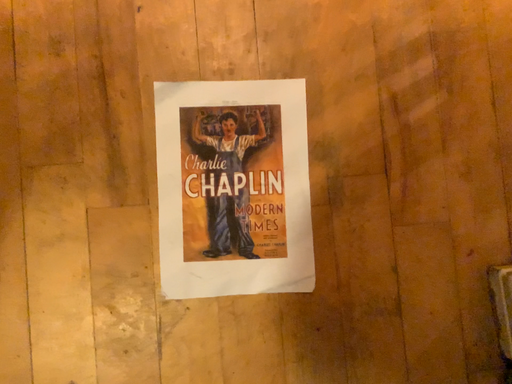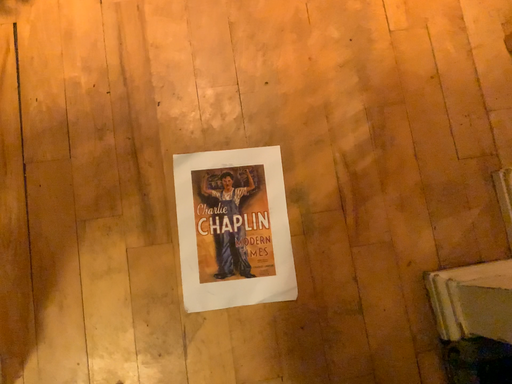
Question: How did the camera likely rotate when shooting the video?

Choices:
 (A) rotated downward
 (B) rotated upward

Answer: (B)